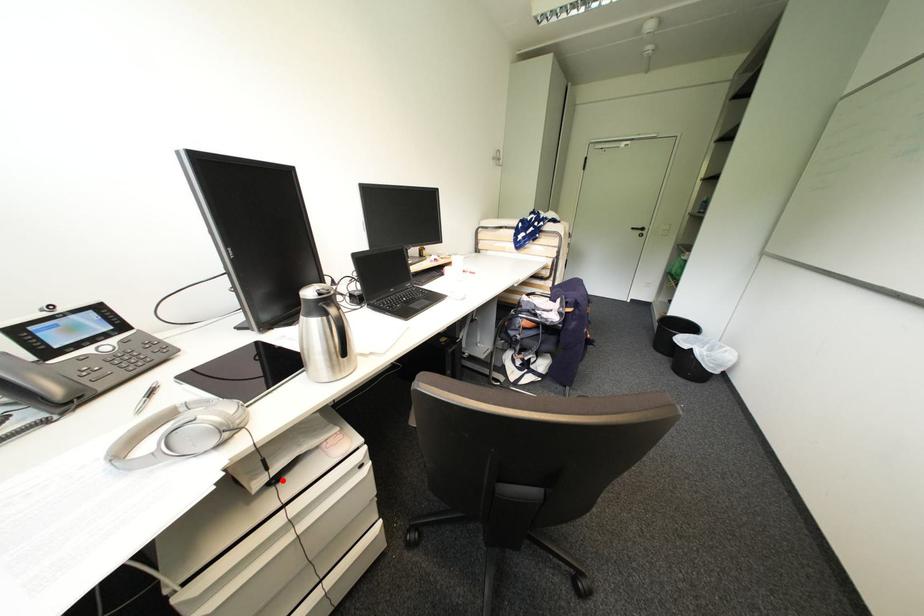
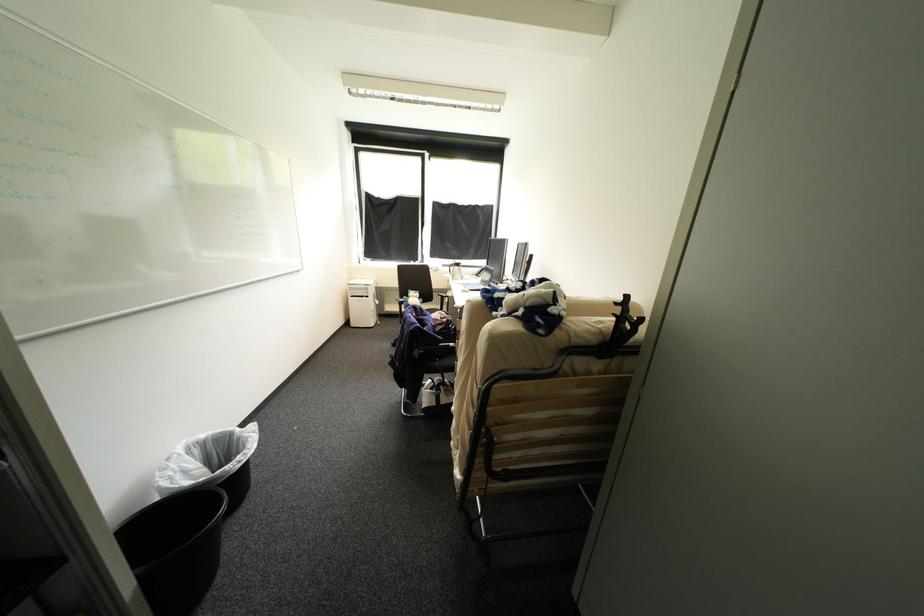
Question: I am providing you with two images of the same scene from different viewpoints. A red point is marked on the first image. Is the red point's position out of view in image 2?

Choices:
 (A) Yes
 (B) No

Answer: (A)